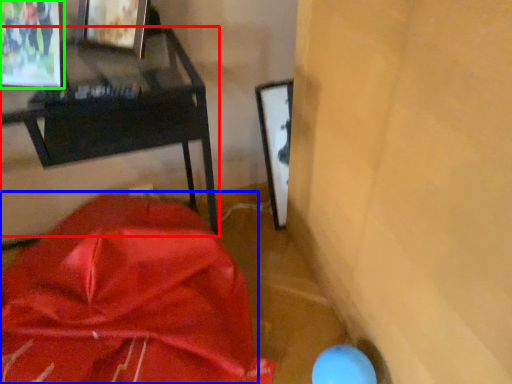
Question: Estimate the real-world distances between objects in this image. Which object is farther from furniture (highlighted by a red box), wrap (highlighted by a blue box) or picture frame (highlighted by a green box)?

Choices:
 (A) wrap
 (B) picture frame

Answer: (A)